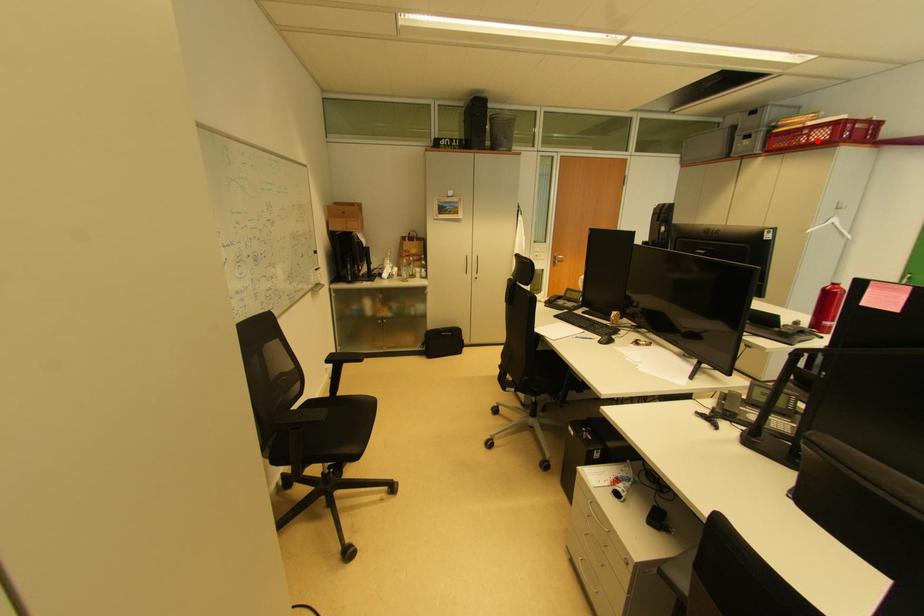
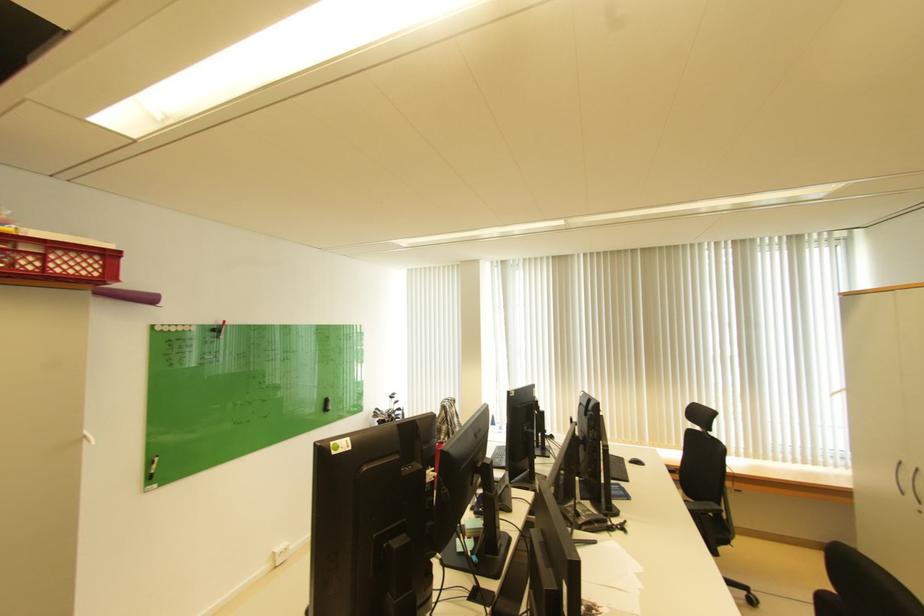
Where in the second image is the point corresponding to the highlighted location from the first image?

(54, 268)